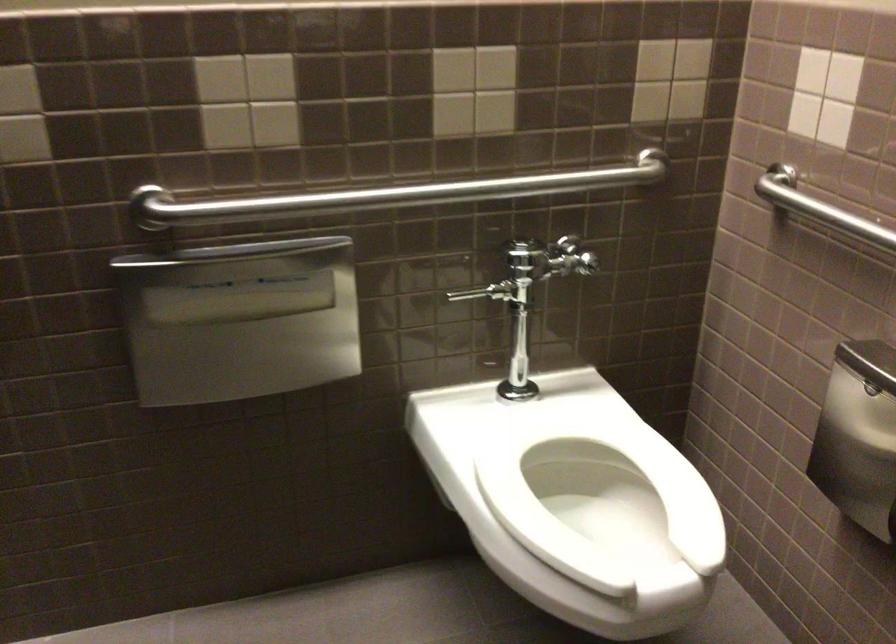
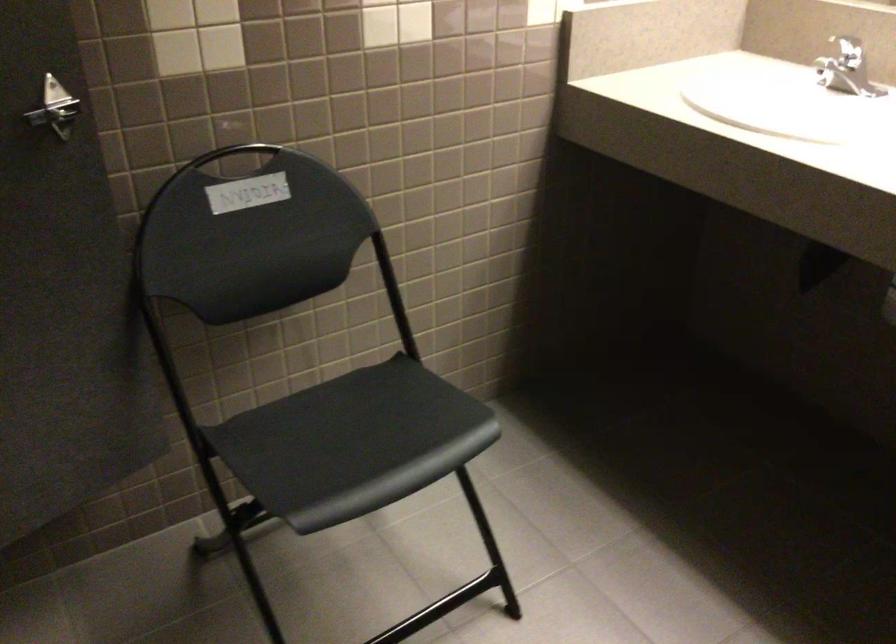
How did the camera likely rotate?

The camera rotated toward right-down.